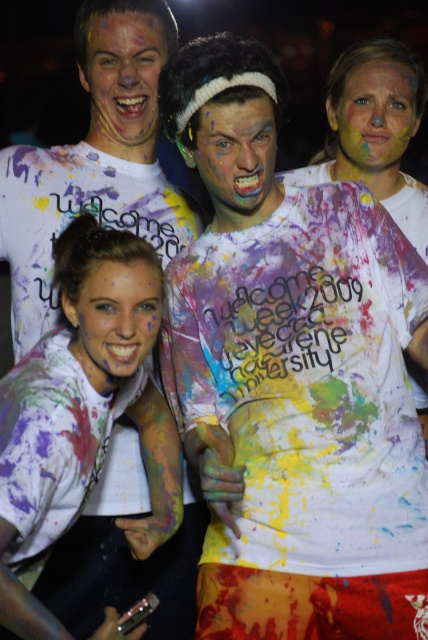
In the scene shown: Who is positioned more to the right, painted skin face at upper left or painted skin face at center?

From the viewer's perspective, painted skin face at center appears more on the right side.

Find the location of `painted skin face at upper left`. painted skin face at upper left is located at coordinates (124, 81).

Find the location of a particular element. The width and height of the screenshot is (428, 640). painted skin face at upper left is located at coordinates (124, 81).

Does point (134, 77) come in front of point (374, 115)?

That is True.

Can you confirm if painted skin face at upper left is positioned above painted skin face at upper right?

Indeed, painted skin face at upper left is positioned over painted skin face at upper right.

Is point (151, 16) positioned before point (389, 93)?

Yes, point (151, 16) is in front of point (389, 93).

Locate an element on the screen. The width and height of the screenshot is (428, 640). painted skin face at upper left is located at coordinates (124, 81).

Which is below, matte white face at lower left or painted skin face at center?

Positioned lower is matte white face at lower left.

Can you confirm if matte white face at lower left is positioned above painted skin face at center?

No.

Locate an element on the screen. Image resolution: width=428 pixels, height=640 pixels. matte white face at lower left is located at coordinates (115, 317).

Locate an element on the screen. Image resolution: width=428 pixels, height=640 pixels. matte white face at lower left is located at coordinates (115, 317).